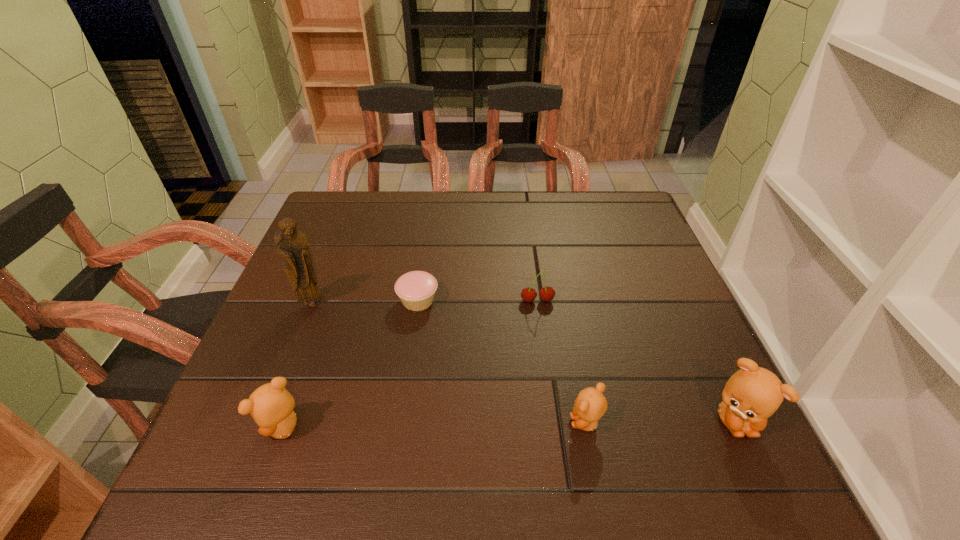
At what (x,y) coordinates should I click in order to perform the action: click on vacant position for inserting another teddy_bear evenly. Please return your answer as a coordinate pair (x, y). Looking at the image, I should click on point(436,425).